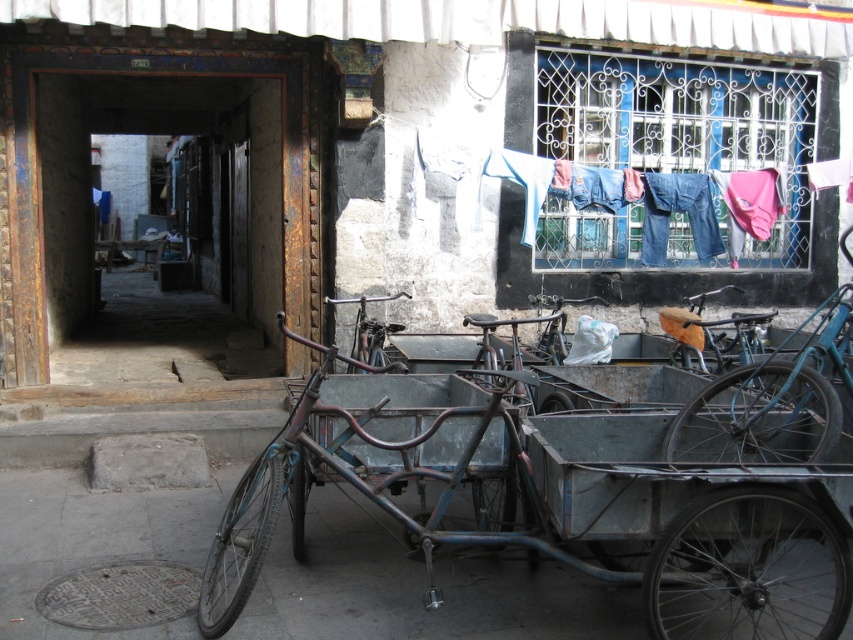
Question: Which object is farther from the camera taking this photo?

Choices:
 (A) rusty metal bicycle at center
 (B) rusty metal tricycle at center
 (C) smooth concrete pavement at lower center
 (D) metallic silver bicycle at center

Answer: (D)

Question: Estimate the real-world distances between objects in this image. Which object is closer to the rusty metal tricycle at center?

Choices:
 (A) denim jeans at upper right
 (B) rusty metal bicycle at center

Answer: (B)

Question: Can you confirm if denim jeans at upper right is positioned to the left of rusty metal bicycle at center?

Choices:
 (A) yes
 (B) no

Answer: (B)

Question: Which point is closer to the camera taking this photo?

Choices:
 (A) (689, 410)
 (B) (380, 326)
 (C) (422, 168)
 (D) (543, 349)

Answer: (A)

Question: Is smooth concrete pavement at lower center positioned before orange fabric-covered bicycle at center?

Choices:
 (A) yes
 (B) no

Answer: (A)

Question: Can you confirm if smooth concrete pavement at lower center is positioned to the right of metallic silver bicycle at center?

Choices:
 (A) yes
 (B) no

Answer: (B)